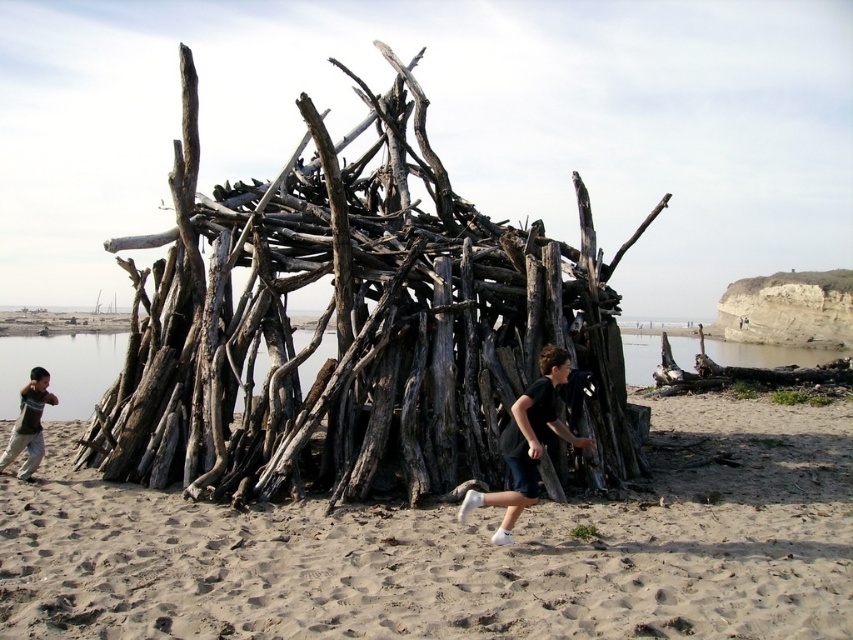
Question: Which object is farther from the camera taking this photo?

Choices:
 (A) black matte shorts at center
 (B) drab wood structure at center

Answer: (B)

Question: Estimate the real-world distances between objects in this image. Which object is closer to the drab wood structure at center?

Choices:
 (A) dark gray cotton shirt at lower left
 (B) light beige sand at lower center

Answer: (B)

Question: Which point is farther to the camera?

Choices:
 (A) (257, 280)
 (B) (561, 372)

Answer: (A)

Question: In this image, where is drab wood structure at center located relative to dark gray cotton shirt at lower left?

Choices:
 (A) left
 (B) right

Answer: (B)

Question: Can you confirm if drab wood structure at center is bigger than black matte shorts at center?

Choices:
 (A) no
 (B) yes

Answer: (B)

Question: From the image, what is the correct spatial relationship of black matte shorts at center in relation to dark gray cotton shirt at lower left?

Choices:
 (A) right
 (B) left

Answer: (A)